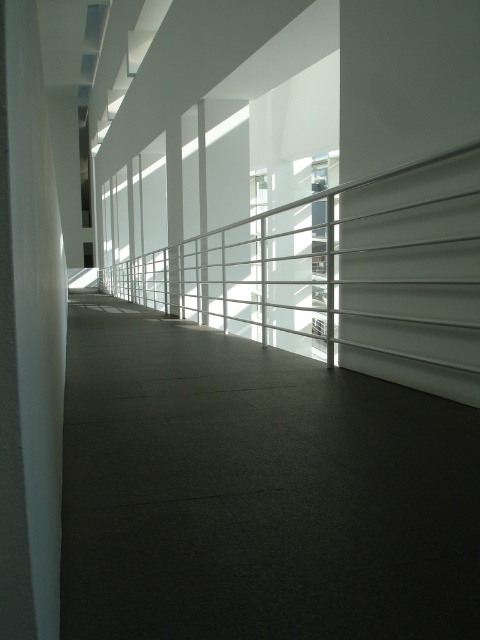
Question: Does white metallic rail at center have a greater width compared to white smooth pillar at left?

Choices:
 (A) yes
 (B) no

Answer: (A)

Question: Does white metallic rail at center have a greater width compared to white smooth pillar at left?

Choices:
 (A) no
 (B) yes

Answer: (B)

Question: Is white metallic rail at center to the left of white smooth pillar at left from the viewer's perspective?

Choices:
 (A) no
 (B) yes

Answer: (A)